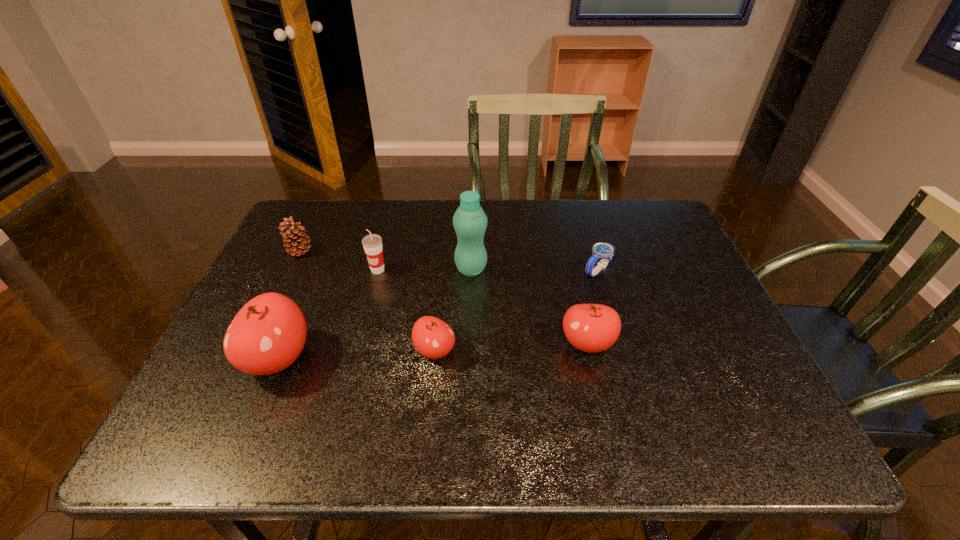
At what (x,y) coordinates should I click in order to perform the action: click on free region located on the left of the second apple from right to left. Please return your answer as a coordinate pair (x, y). This screenshot has height=540, width=960. Looking at the image, I should click on (276, 350).

Locate an element on the screen. The width and height of the screenshot is (960, 540). vacant area situated on the left of the rightmost apple is located at coordinates (486, 343).

The height and width of the screenshot is (540, 960). What are the coordinates of `vacant point located 0.230m on the back of the pinecone` in the screenshot? It's located at (325, 201).

Identify the location of vacant space located on the right of the bottle. (564, 269).

Image resolution: width=960 pixels, height=540 pixels. I want to click on free space located 0.320m on the front of the shortest object, so click(633, 385).

Locate an element on the screen. This screenshot has width=960, height=540. free spot located on the side of the fifth object from right to left with the logo is located at coordinates (372, 294).

This screenshot has width=960, height=540. Find the location of `object at the far edge`. object at the far edge is located at coordinates (295, 235).

Where is `object that is positioned at the near edge`? The height and width of the screenshot is (540, 960). object that is positioned at the near edge is located at coordinates (267, 335).

Find the location of a particular element. apple that is at the left edge is located at coordinates (267, 335).

Find the location of a particular element. The image size is (960, 540). pinecone situated at the left edge is located at coordinates (295, 235).